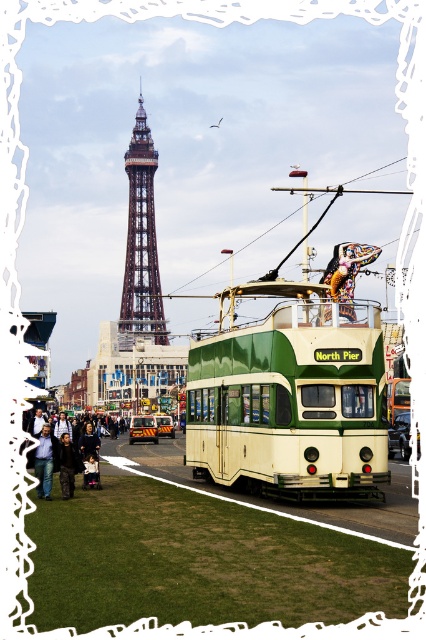
You are standing on the street in front of the brown wooden tower at center and the dark blue jeans at lower left. Which object is closer to you?

The dark blue jeans at lower left are closer to you because the brown wooden tower at center is further away.

You are a tourist standing on the street in front of the brown wooden tower at center and the jeans at lower left. Which object is taller?

The brown wooden tower at center is taller than the jeans at lower left.

You are standing at the Blackpool Tower and want to take a photo of the North Pier tram. You notice two points in the scene labeled as point 1 at coordinates (132, 154) and point 2 at coordinates (60, 472). Which point is closer to your camera position?

Point 2 at coordinates (60, 472) is closer to the camera because it is less far away than point 1 at coordinates (132, 154), which is further away from the camera.